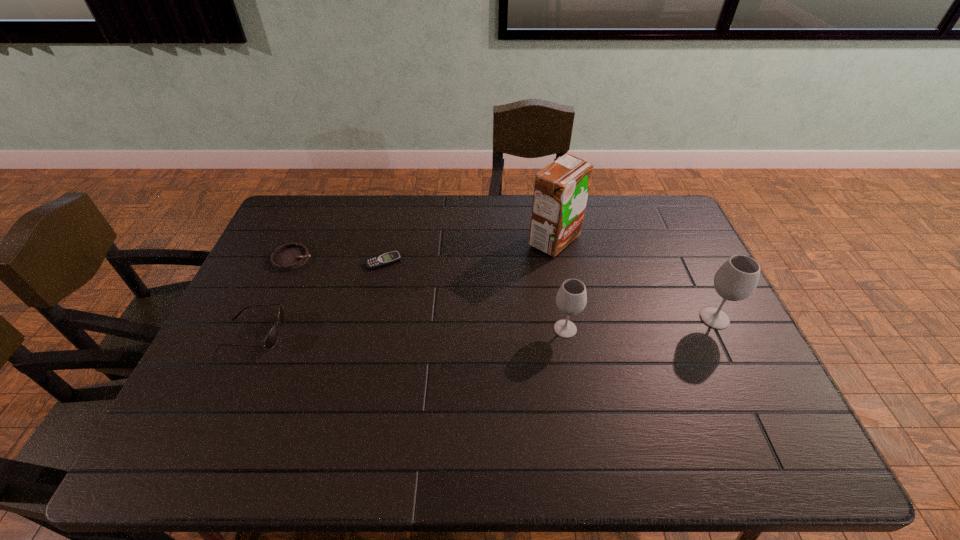
Where is `object positioned at the right edge`? The width and height of the screenshot is (960, 540). object positioned at the right edge is located at coordinates (737, 279).

Find the location of a particular element. The image size is (960, 540). free space at the far edge of the desktop is located at coordinates (348, 208).

I want to click on vacant point at the near edge, so click(597, 391).

You are a GUI agent. You are given a task and a screenshot of the screen. Output one action in this format:
    pyautogui.click(x=<x>, y=<y>)
    Task: Click on the free space at the left edge of the desktop
    The image size is (960, 540).
    Given the screenshot: What is the action you would take?
    pyautogui.click(x=237, y=304)

Identify the location of vacant space at the right edge. (735, 369).

At what (x,y) coordinates should I click in order to perform the action: click on vacant space at the far left corner of the desktop. Please return your answer as a coordinate pair (x, y). Looking at the image, I should click on (290, 235).

At what (x,y) coordinates should I click in order to perform the action: click on vacant region between the rightmost object and the sunglasses. Please return your answer as a coordinate pair (x, y). Looking at the image, I should click on (485, 326).

Locate an element on the screen. The height and width of the screenshot is (540, 960). free space between the right wineglass and the fourth tallest object is located at coordinates (485, 326).

The image size is (960, 540). Identify the location of free space between the beeper and the taller wineglass. (549, 290).

Image resolution: width=960 pixels, height=540 pixels. What are the coordinates of `vacant area between the fifth tallest object and the rightmost object` in the screenshot? It's located at (504, 288).